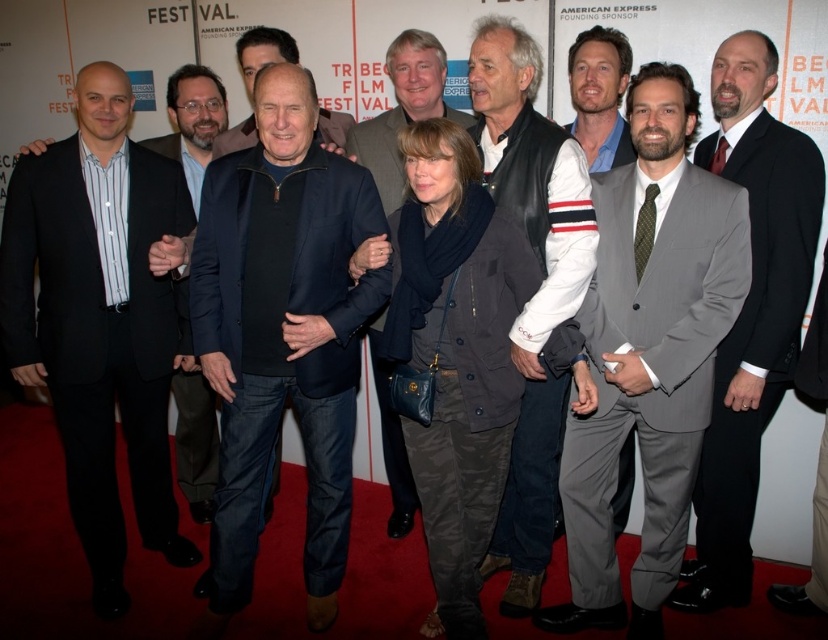
You are a photographer at the Tribeca Festival event. You need to arrange the two central figures wearing the gray pinstripe suit at center and the dark gray leather jacket at center for a better composition. Which one should you move to the left to create symmetry?

The gray pinstripe suit at center should be moved to the left to align with the dark gray leather jacket at center since it is currently on the right side of the jacket.

You are standing at the point with coordinates point (x=590, y=38) and want to move to the point with coordinates point (x=785, y=385). Given that you can only move forward in a straight line, will you be able to reach your destination without changing direction?

Point (x=785, y=385) is behind point (x=590, y=38), so you will not be able to reach your destination without changing direction because the path is blocked by the point in front.